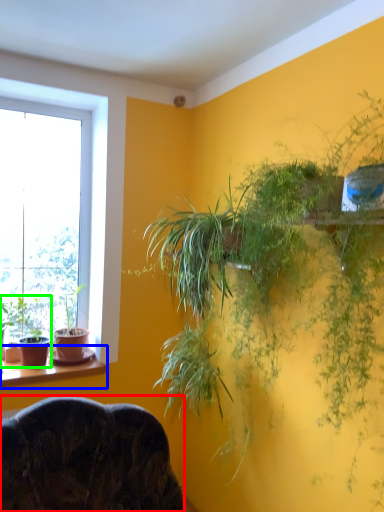
Question: Which object is positioned farthest from furniture (highlighted by a red box)? Select from window sill (highlighted by a blue box) and houseplant (highlighted by a green box).

Choices:
 (A) window sill
 (B) houseplant

Answer: (B)